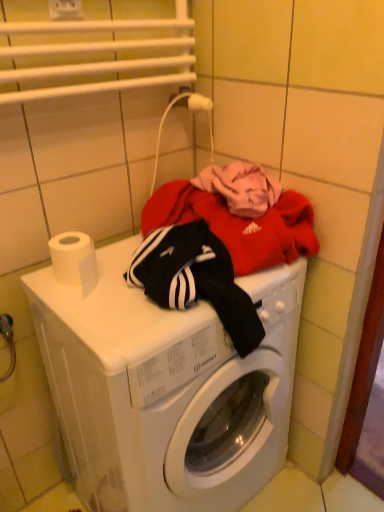
What are the coordinates of `unoccupied area in front of white matte toilet paper at upper left` in the screenshot? It's located at (94, 320).